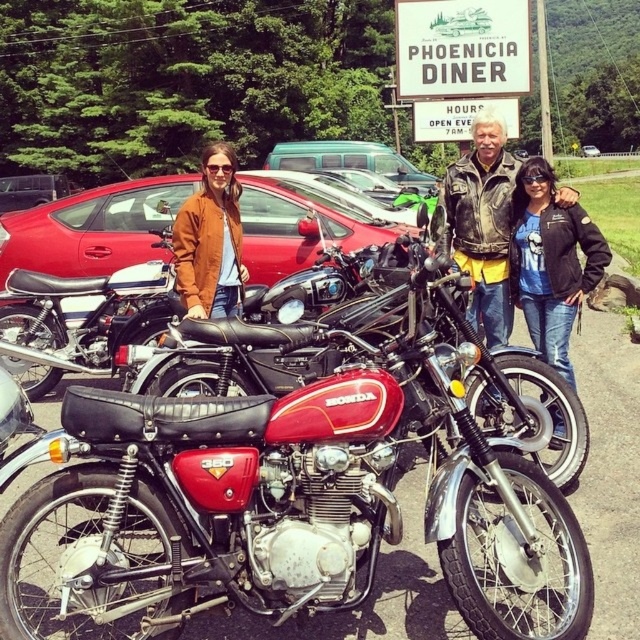
Measure the distance between point (484, 225) and camera.

Point (484, 225) and camera are 6.58 meters apart.

Can you confirm if leather jacket at center is wider than matte brown jacket at center?

No, leather jacket at center is not wider than matte brown jacket at center.

Is point (486, 157) positioned in front of point (182, 218)?

Yes.

Where is `leather jacket at center`? leather jacket at center is located at coordinates (481, 224).

How distant is metallic red car at center from matte brown jacket at center?

metallic red car at center is 1.64 meters away from matte brown jacket at center.

Is metallic red car at center smaller than matte brown jacket at center?

Actually, metallic red car at center might be larger than matte brown jacket at center.

Does point (68, 252) come in front of point (234, 259)?

No, it is behind (234, 259).

Where is `metallic red car at center`? metallic red car at center is located at coordinates (93, 228).

Is point (490, 266) farther from viewer compared to point (545, 172)?

Yes, it is behind point (545, 172).

Is leather jacket at center behind denim jacket at center?

No, it is not.

Which is in front, point (488, 189) or point (522, 243)?

Point (522, 243)

Find the location of a particular element. This screenshot has height=640, width=640. leather jacket at center is located at coordinates (481, 224).